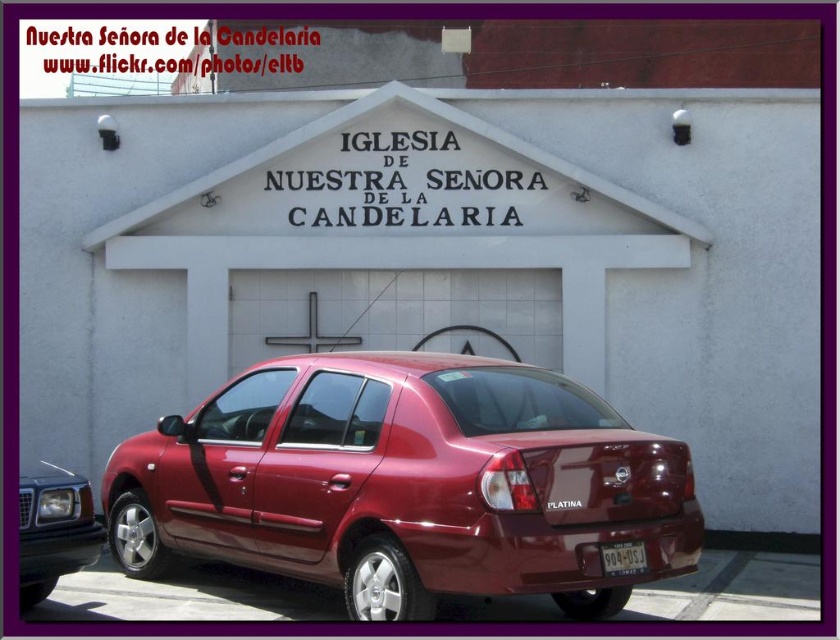
Question: Which point appears closest to the camera in this image?

Choices:
 (A) 75,481
 (B) 271,422

Answer: (A)

Question: Does satin burgundy sedan at lower left appear over yellowish matte license plate at center?

Choices:
 (A) no
 (B) yes

Answer: (A)

Question: Which of the following is the closest to the observer?

Choices:
 (A) (612, 545)
 (B) (92, 560)

Answer: (A)

Question: Which object is the farthest from the satin burgundy sedan at lower left?

Choices:
 (A) satin burgundy sedan at lower center
 (B) yellowish matte license plate at center

Answer: (B)

Question: Does satin burgundy sedan at lower center come in front of yellowish matte license plate at center?

Choices:
 (A) yes
 (B) no

Answer: (A)

Question: Can you confirm if satin burgundy sedan at lower center is positioned to the right of satin burgundy sedan at lower left?

Choices:
 (A) no
 (B) yes

Answer: (B)